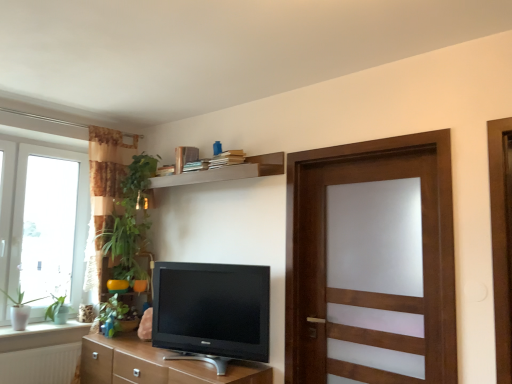
Question: Should I look upward or downward to see wooden shelf at upper center?

Choices:
 (A) down
 (B) up

Answer: (B)

Question: Does brown wood cabinet at lower center come behind white ceramic window sill at lower left?

Choices:
 (A) yes
 (B) no

Answer: (B)

Question: Does brown wood cabinet at lower center have a greater width compared to white ceramic window sill at lower left?

Choices:
 (A) no
 (B) yes

Answer: (B)

Question: Is brown wood cabinet at lower center closer to camera compared to white ceramic window sill at lower left?

Choices:
 (A) no
 (B) yes

Answer: (B)

Question: Is brown wood cabinet at lower center smaller than white ceramic window sill at lower left?

Choices:
 (A) yes
 (B) no

Answer: (B)

Question: Is brown wood cabinet at lower center at the right side of white ceramic window sill at lower left?

Choices:
 (A) yes
 (B) no

Answer: (A)

Question: From the image's perspective, would you say brown wood cabinet at lower center is shown under white ceramic window sill at lower left?

Choices:
 (A) yes
 (B) no

Answer: (A)

Question: Does brown wood cabinet at lower center appear on the left side of green leafy plant at left, arranged as the first plant when viewed from the right?

Choices:
 (A) yes
 (B) no

Answer: (B)

Question: From a real-world perspective, is brown wood cabinet at lower center under green leafy plant at left, the third plant viewed from the left?

Choices:
 (A) yes
 (B) no

Answer: (A)

Question: Is brown wood cabinet at lower center completely or partially outside of green leafy plant at left, arranged as the first plant when viewed from the right?

Choices:
 (A) yes
 (B) no

Answer: (A)

Question: From the image's perspective, does brown wood cabinet at lower center appear lower than green leafy plant at left, the third plant viewed from the left?

Choices:
 (A) yes
 (B) no

Answer: (A)

Question: Is brown wood cabinet at lower center touching green leafy plant at left, arranged as the first plant when viewed from the right?

Choices:
 (A) yes
 (B) no

Answer: (B)

Question: Does brown wood cabinet at lower center lie behind green leafy plant at left, arranged as the first plant when viewed from the right?

Choices:
 (A) yes
 (B) no

Answer: (B)

Question: Considering the relative positions of wooden shelf at upper center and white ceramic window sill at lower left in the image provided, is wooden shelf at upper center behind white ceramic window sill at lower left?

Choices:
 (A) no
 (B) yes

Answer: (A)